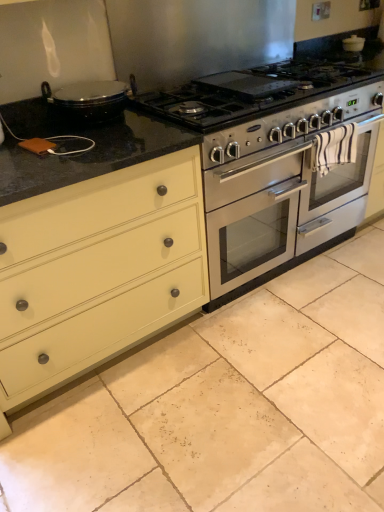
Question: Could you tell me if stainless steel oven at center is turned towards matte cream drawer at left?

Choices:
 (A) no
 (B) yes

Answer: (A)

Question: From a real-world perspective, is stainless steel oven at center physically above matte cream drawer at left?

Choices:
 (A) no
 (B) yes

Answer: (A)

Question: Can you confirm if stainless steel oven at center is shorter than matte cream drawer at left?

Choices:
 (A) no
 (B) yes

Answer: (B)

Question: Considering the relative sizes of stainless steel oven at center and matte cream drawer at left in the image provided, is stainless steel oven at center wider than matte cream drawer at left?

Choices:
 (A) yes
 (B) no

Answer: (A)

Question: Is stainless steel oven at center facing away from matte cream drawer at left?

Choices:
 (A) yes
 (B) no

Answer: (B)

Question: Can you confirm if stainless steel oven at center is thinner than matte cream drawer at left?

Choices:
 (A) yes
 (B) no

Answer: (B)

Question: Is beige matte tile at center wider than satin silver gas stove at center?

Choices:
 (A) no
 (B) yes

Answer: (B)

Question: Is beige matte tile at center not close to satin silver gas stove at center?

Choices:
 (A) no
 (B) yes

Answer: (B)

Question: Can you confirm if beige matte tile at center is taller than satin silver gas stove at center?

Choices:
 (A) yes
 (B) no

Answer: (B)

Question: Considering the relative sizes of beige matte tile at center and satin silver gas stove at center in the image provided, is beige matte tile at center shorter than satin silver gas stove at center?

Choices:
 (A) no
 (B) yes

Answer: (B)

Question: Could you tell me if beige matte tile at center is turned towards satin silver gas stove at center?

Choices:
 (A) no
 (B) yes

Answer: (A)

Question: Is beige matte tile at center to the right of satin silver gas stove at center from the viewer's perspective?

Choices:
 (A) yes
 (B) no

Answer: (A)

Question: From the image's perspective, is stainless steel oven at center located above beige matte tile at center?

Choices:
 (A) yes
 (B) no

Answer: (A)